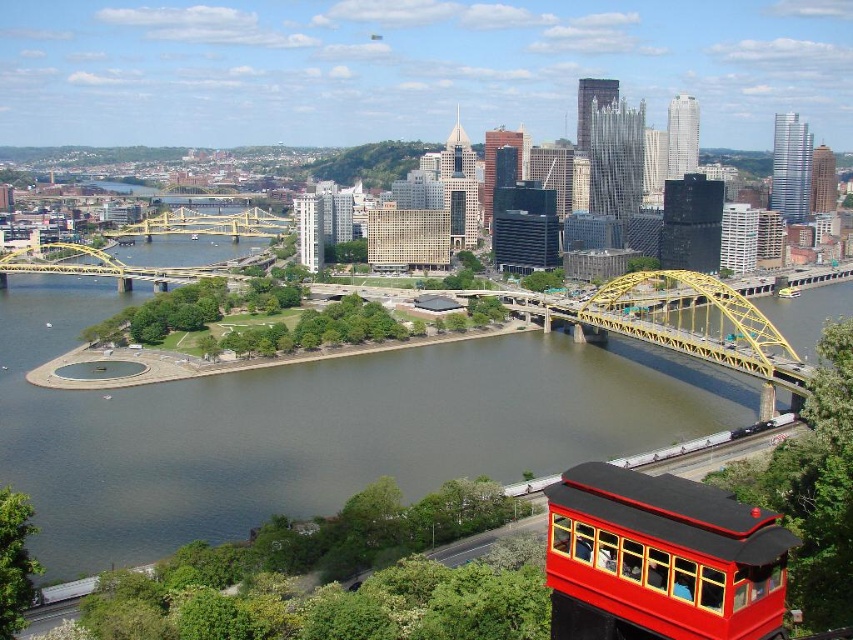
Question: Which object appears closest to the camera in this image?

Choices:
 (A) shiny red trolley car at lower right
 (B) brown water at center

Answer: (A)

Question: Is brown water at center wider than shiny red trolley car at lower right?

Choices:
 (A) yes
 (B) no

Answer: (A)

Question: Does brown water at center appear on the right side of shiny red trolley car at lower right?

Choices:
 (A) yes
 (B) no

Answer: (B)

Question: Is brown water at center positioned in front of shiny red trolley car at lower right?

Choices:
 (A) no
 (B) yes

Answer: (A)